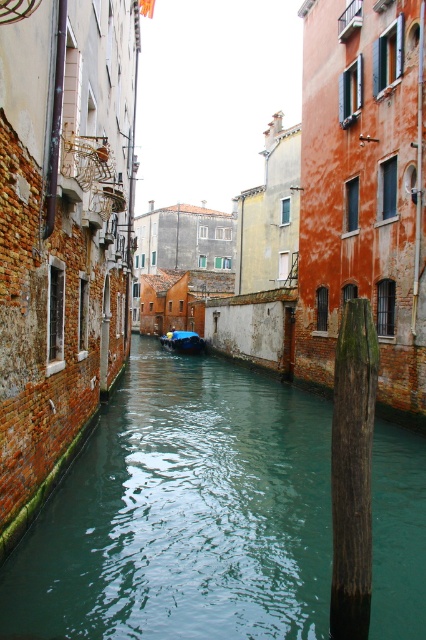
You are standing on the canal bridge and want to take a photo of the green water at center. Where should you point your camera to capture it?

You should point your camera towards the coordinates point at (184, 513) to capture the green water at center.

You are standing at the edge of the canal and want to determine which of the two points, point (115, 570) or point (192, 332), is closer to you. Based on the scene, which point is nearer?

Point (115, 570) is closer to the viewer than point (192, 332).